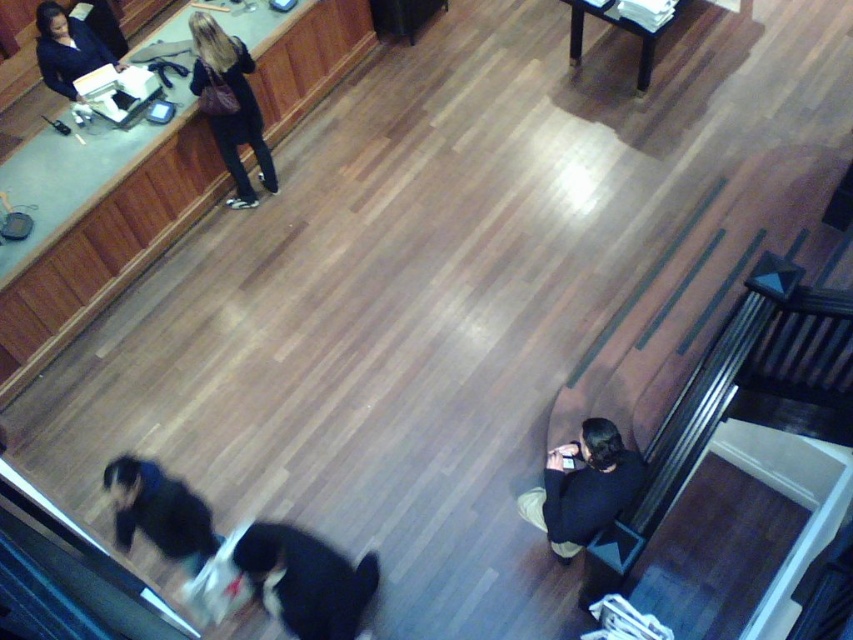
Question: Does black fur dog at lower center have a larger size compared to dark blue jeans at upper center?

Choices:
 (A) no
 (B) yes

Answer: (A)

Question: Estimate the real-world distances between objects in this image. Which object is farther from the matte black stool at lower right?

Choices:
 (A) black fur dog at lower center
 (B) matte black jacket at upper left
 (C) black soft fabric at lower right

Answer: (B)

Question: Based on their relative distances, which object is nearer to the dark blue jeans at upper center?

Choices:
 (A) black soft fabric at lower right
 (B) dark blue jacket at lower left

Answer: (B)

Question: Is dark blue jacket at lower left below matte black jacket at upper left?

Choices:
 (A) no
 (B) yes

Answer: (B)

Question: Among these objects, which one is farthest from the camera?

Choices:
 (A) dark blue jacket at lower left
 (B) black fur dog at lower center

Answer: (A)

Question: Observing the image, what is the correct spatial positioning of matte black jacket at upper left in reference to matte black stool at lower right?

Choices:
 (A) left
 (B) right

Answer: (A)